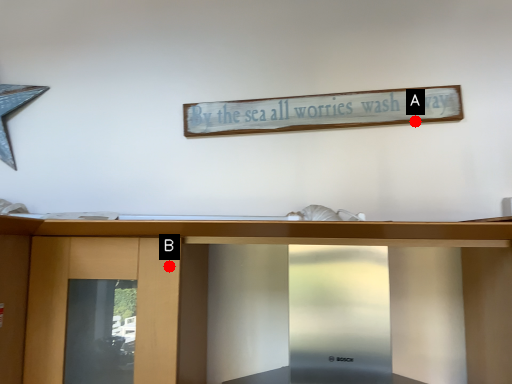
Question: Two points are circled on the image, labeled by A and B beside each circle. Among these points, which one is nearest to the camera?

Choices:
 (A) A is closer
 (B) B is closer

Answer: (B)